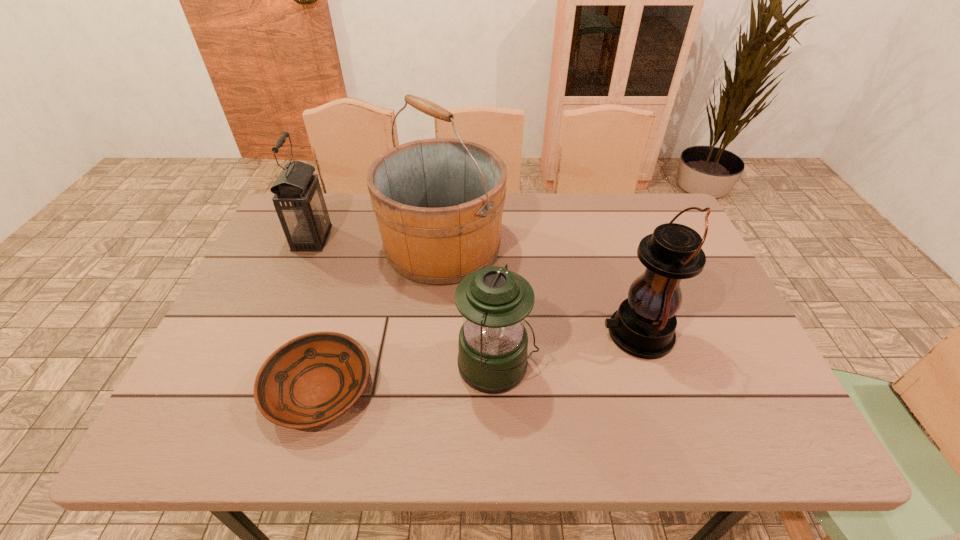
Locate an element on the screen. The height and width of the screenshot is (540, 960). object located at the near left corner is located at coordinates (313, 379).

In the image, there is a desktop. At what (x,y) coordinates should I click in order to perform the action: click on free space at the far edge. Please return your answer as a coordinate pair (x, y). Looking at the image, I should click on (372, 224).

Locate an element on the screen. The image size is (960, 540). vacant space at the near edge of the desktop is located at coordinates (348, 441).

Where is `vacant space at the left edge`? The image size is (960, 540). vacant space at the left edge is located at coordinates (280, 338).

The image size is (960, 540). In the image, there is a desktop. In order to click on vacant space at the far right corner in this screenshot , I will do `click(653, 217)`.

Identify the location of free region at the near right corner of the desktop. (707, 430).

Image resolution: width=960 pixels, height=540 pixels. In order to click on free space that is in between the farthest lantern and the bucket in this screenshot , I will do `click(377, 242)`.

Find the location of `free space between the farthest lantern and the fourth tallest object`. free space between the farthest lantern and the fourth tallest object is located at coordinates (404, 302).

You are a GUI agent. You are given a task and a screenshot of the screen. Output one action in this format:
    pyautogui.click(x=<x>, y=<y>)
    Task: Click on the unoccupied position between the rightmost lantern and the second lantern from left to right
    The width and height of the screenshot is (960, 540).
    Given the screenshot: What is the action you would take?
    pyautogui.click(x=567, y=350)

Identify the location of unoccupied position between the plate and the leftmost lantern. (316, 313).